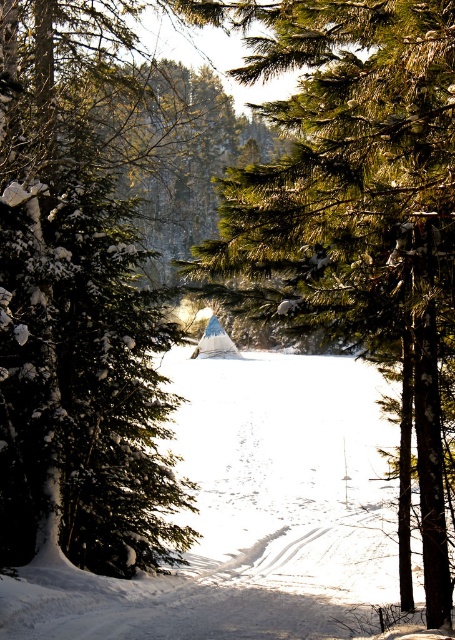
Question: Where is green matte evergreen tree at left located in relation to white powdery snow at center in the image?

Choices:
 (A) left
 (B) right

Answer: (A)

Question: Which object is closer to the camera taking this photo?

Choices:
 (A) white powdery snow at center
 (B) green matte evergreen tree at left

Answer: (A)

Question: Which point is farther to the camera?

Choices:
 (A) (95, 189)
 (B) (79, 634)
 (C) (349, 195)

Answer: (A)

Question: Among these objects, which one is nearest to the camera?

Choices:
 (A) white powdery snow at center
 (B) green matte evergreen tree at left
 (C) green textured pine tree at center

Answer: (C)

Question: Is green textured pine tree at center wider than white powdery snow at center?

Choices:
 (A) no
 (B) yes

Answer: (A)

Question: Can you confirm if green textured pine tree at center is thinner than white powdery snow at center?

Choices:
 (A) yes
 (B) no

Answer: (A)